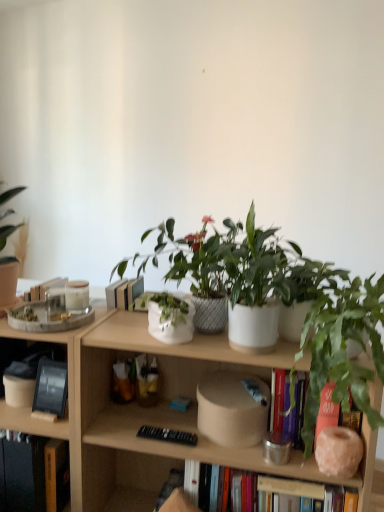
Question: Considering the positions of green matte houseplant at right and wooden bookcase at center in the image, is green matte houseplant at right bigger or smaller than wooden bookcase at center?

Choices:
 (A) big
 (B) small

Answer: (B)

Question: Looking at their shapes, would you say green matte houseplant at right is wider or thinner than wooden bookcase at center?

Choices:
 (A) wide
 (B) thin

Answer: (B)

Question: Estimate the real-world distances between objects in this image. Which object is farther from the wooden bookcase at center?

Choices:
 (A) green matte houseplant at right
 (B) hardcover book at lower left, arranged as the 2th book when viewed from the top
 (C) black matte tablet at left, which ranks as the 2th book in bottom-to-top order

Answer: (A)

Question: Considering the real-world distances, which object is farthest from the black matte tablet at left, the first book when ordered from top to bottom?

Choices:
 (A) green matte houseplant at right
 (B) hardcover book at lower left, arranged as the 2th book when viewed from the top
 (C) wooden bookcase at center

Answer: (A)